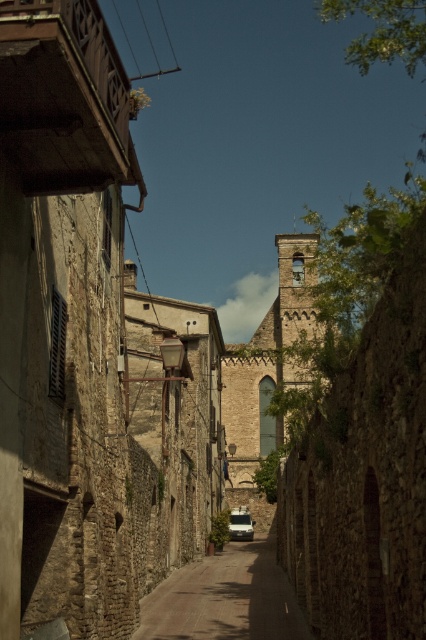
Does smooth stone alley at center come in front of white matte van at center?

That is True.

Does smooth stone alley at center appear over white matte van at center?

Correct, smooth stone alley at center is located above white matte van at center.

Is point (264, 630) positioned in front of point (230, 525)?

Yes, it is in front of point (230, 525).

Locate an element on the screen. The image size is (426, 640). smooth stone alley at center is located at coordinates (224, 598).